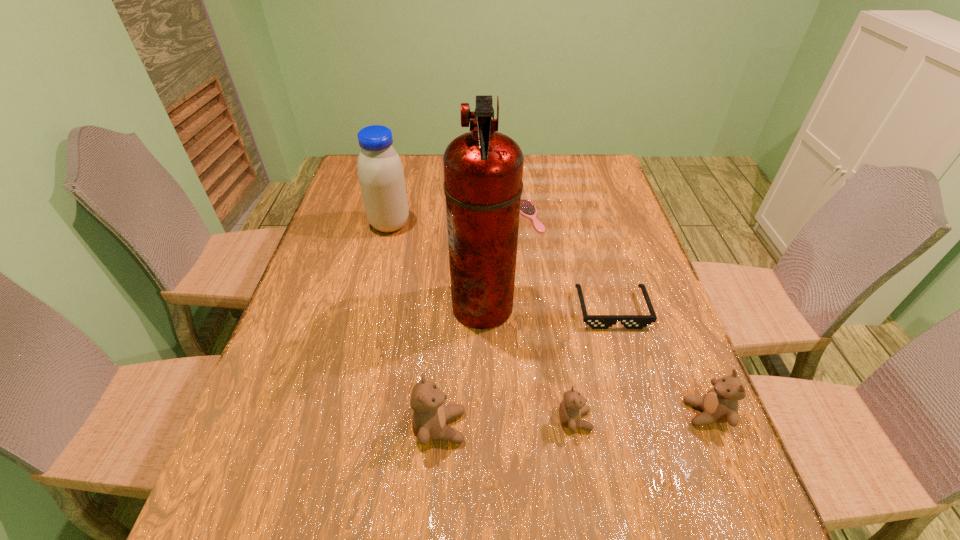
The height and width of the screenshot is (540, 960). What are the coordinates of `the second shortest object` in the screenshot? It's located at (595, 321).

Identify the location of sunglasses. (595, 321).

Image resolution: width=960 pixels, height=540 pixels. In order to click on free space located on the front-facing side of the tallest teddy bear in this screenshot , I will do `click(531, 427)`.

In order to click on vacant space located on the front-facing side of the shortest teddy bear in this screenshot , I will do `click(616, 420)`.

Locate an element on the screen. The image size is (960, 540). free space located 0.360m on the front-facing side of the rightmost teddy bear is located at coordinates (508, 413).

Locate an element on the screen. The height and width of the screenshot is (540, 960). free region located 0.180m on the front-facing side of the rightmost teddy bear is located at coordinates (597, 413).

This screenshot has height=540, width=960. What are the coordinates of `vacant region located 0.320m on the front-facing side of the rightmost teddy bear` in the screenshot? It's located at (528, 413).

Where is `free space located 0.110m on the back of the second tallest object`? This screenshot has height=540, width=960. free space located 0.110m on the back of the second tallest object is located at coordinates (397, 193).

Image resolution: width=960 pixels, height=540 pixels. Identify the location of vacant space located on the back of the shortest object. (525, 182).

Locate an element on the screen. This screenshot has width=960, height=540. free location located on the nozzle side of the fire extinguisher is located at coordinates (311, 306).